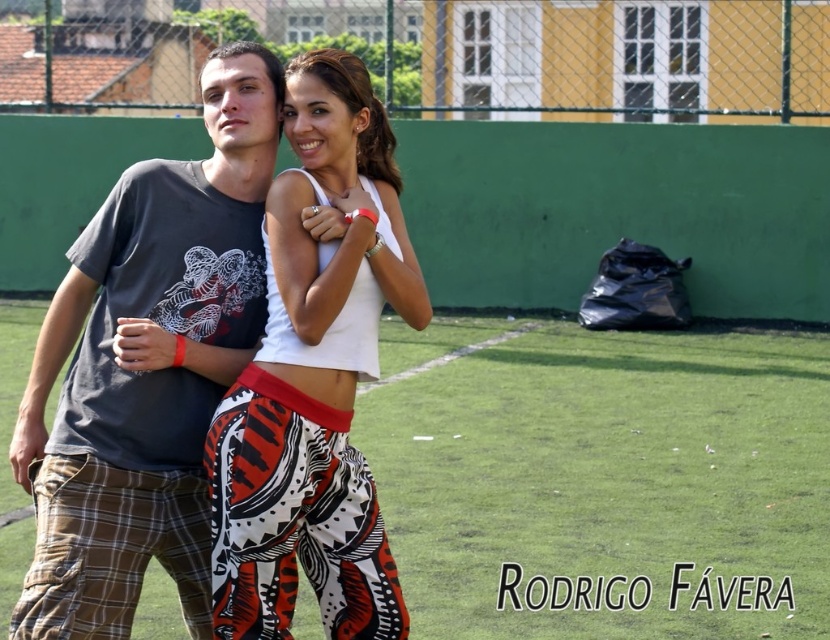
Question: Can you confirm if dark gray t-shirt at center is thinner than white matte tank top at center?

Choices:
 (A) yes
 (B) no

Answer: (B)

Question: Which point is closer to the camera taking this photo?

Choices:
 (A) (125, 424)
 (B) (384, 275)

Answer: (B)

Question: Does dark gray t-shirt at center have a lesser width compared to white matte tank top at center?

Choices:
 (A) yes
 (B) no

Answer: (B)

Question: Is dark gray t-shirt at center to the left of white matte tank top at center from the viewer's perspective?

Choices:
 (A) no
 (B) yes

Answer: (B)

Question: Among these objects, which one is nearest to the camera?

Choices:
 (A) white matte tank top at center
 (B) dark gray t-shirt at center

Answer: (B)